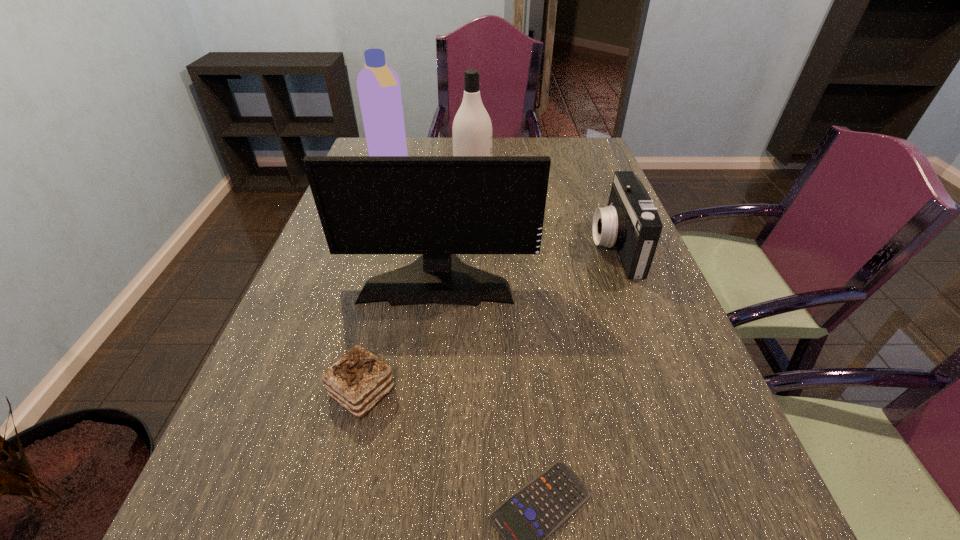
Locate an element on the screen. object at the right edge is located at coordinates (630, 223).

Find the location of `object located in the far left corner section of the desktop`. object located in the far left corner section of the desktop is located at coordinates (378, 85).

In order to click on blank area at the far edge in this screenshot , I will do `click(415, 147)`.

Where is `free space at the left edge of the desktop`? Image resolution: width=960 pixels, height=540 pixels. free space at the left edge of the desktop is located at coordinates (280, 388).

Locate an element on the screen. This screenshot has height=540, width=960. blank area at the right edge is located at coordinates (684, 451).

Find the location of `vacant area that lies between the monitor and the third shortest object`. vacant area that lies between the monitor and the third shortest object is located at coordinates (527, 262).

Locate an element on the screen. The height and width of the screenshot is (540, 960). vacant area between the chocolate cake and the rightmost object is located at coordinates (489, 320).

Find the location of a particular element. The image size is (960, 540). free spot between the chocolate cake and the third shortest object is located at coordinates (489, 320).

The width and height of the screenshot is (960, 540). I want to click on object that stands as the second closest to the calculator, so click(x=439, y=206).

Image resolution: width=960 pixels, height=540 pixels. I want to click on object that ranks as the fifth closest to the nearer shampoo, so click(x=528, y=517).